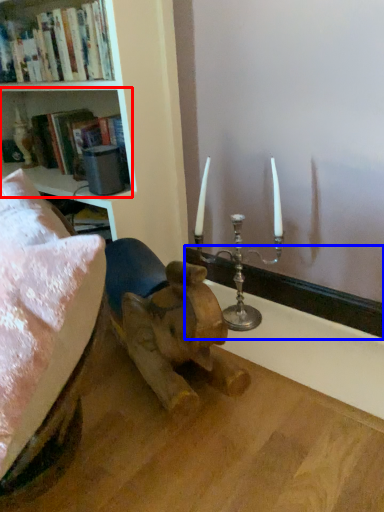
Question: Which object is closer to the camera taking this photo, shelf (highlighted by a red box) or window sill (highlighted by a blue box)?

Choices:
 (A) shelf
 (B) window sill

Answer: (B)